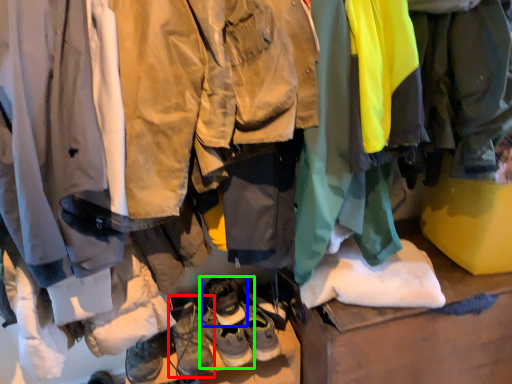
Question: Estimate the real-world distances between objects in this image. Which object is closer to footwear (highlighted by a red box), footwear (highlighted by a blue box) or footwear (highlighted by a green box)?

Choices:
 (A) footwear
 (B) footwear

Answer: (B)